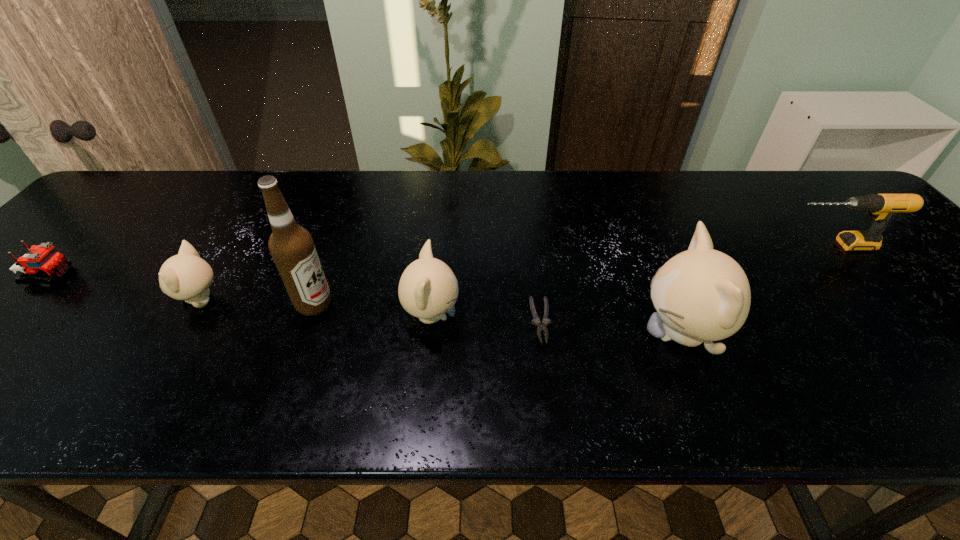
Where is `vacant space positioned on the face of the tallest kitten`? The height and width of the screenshot is (540, 960). vacant space positioned on the face of the tallest kitten is located at coordinates (x=506, y=334).

The image size is (960, 540). In order to click on free space located 0.320m on the front-facing side of the leftmost object in this screenshot , I will do `click(206, 276)`.

The image size is (960, 540). I want to click on free spot located on the handle side of the rightmost object, so click(x=634, y=245).

Identify the location of free space located 0.310m on the handle side of the rightmost object. (660, 245).

I want to click on free space located 0.310m on the handle side of the rightmost object, so click(660, 245).

You are a GUI agent. You are given a task and a screenshot of the screen. Output one action in this format:
    pyautogui.click(x=<x>, y=<y>)
    Task: Click on the vacant space located 0.240m on the label of the tallest object
    The width and height of the screenshot is (960, 540).
    Given the screenshot: What is the action you would take?
    pyautogui.click(x=441, y=305)

This screenshot has width=960, height=540. Find the location of `pliers that is at the near edge`. pliers that is at the near edge is located at coordinates (536, 321).

In order to click on object that is at the left edge in this screenshot , I will do `click(42, 261)`.

The image size is (960, 540). I want to click on object positioned at the right edge, so click(881, 206).

Find the location of `free space at the far edge of the desktop`. free space at the far edge of the desktop is located at coordinates (587, 180).